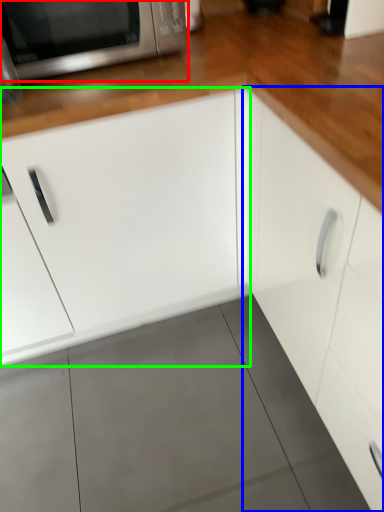
Question: Based on their relative distances, which object is farther from microwave oven (highlighted by a red box)? Choose from cabinetry (highlighted by a blue box) and cabinetry (highlighted by a green box).

Choices:
 (A) cabinetry
 (B) cabinetry

Answer: (A)